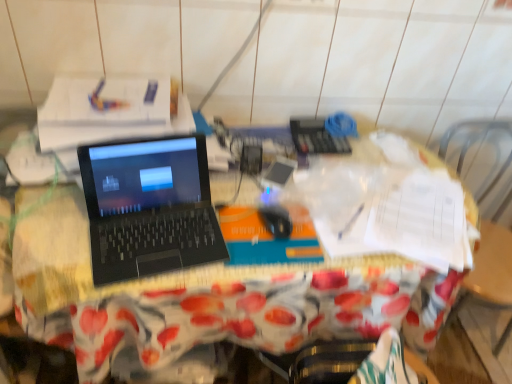
I want to click on blank space to the left of black matte laptop at center, so click(x=49, y=232).